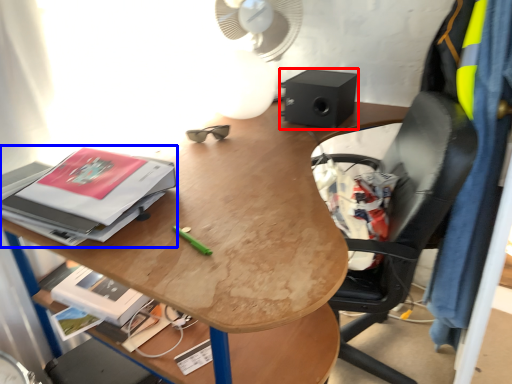
Question: Which of the following is the closest to the observer, loudspeaker (highlighted by a red box) or paperback book (highlighted by a blue box)?

Choices:
 (A) loudspeaker
 (B) paperback book

Answer: (B)